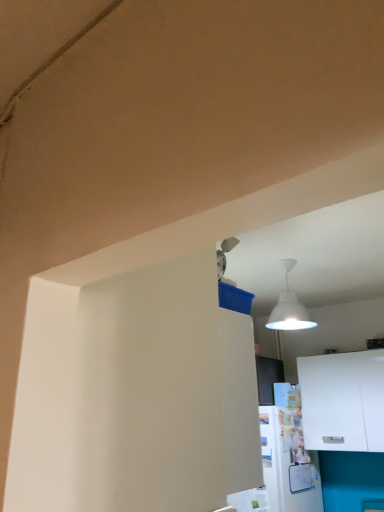
Question: Is point [354, 443] closer or farther from the camera than point [307, 504]?

Choices:
 (A) closer
 (B) farther

Answer: (A)

Question: Looking at the image, does white matte cabinet at lower right seem bigger or smaller compared to white glossy refrigerator at lower right?

Choices:
 (A) small
 (B) big

Answer: (A)

Question: From a real-world perspective, relative to white glossy refrigerator at lower right, is white matte cabinet at lower right vertically above or below?

Choices:
 (A) above
 (B) below

Answer: (A)

Question: Visually, is white glossy refrigerator at lower right positioned to the left or to the right of white matte cabinet at lower right?

Choices:
 (A) right
 (B) left

Answer: (B)

Question: Is white glossy refrigerator at lower right taller or shorter than white matte cabinet at lower right?

Choices:
 (A) short
 (B) tall

Answer: (B)

Question: Is white glossy refrigerator at lower right inside the boundaries of white matte cabinet at lower right, or outside?

Choices:
 (A) inside
 (B) outside

Answer: (B)

Question: Does point (248, 500) appear closer or farther from the camera than point (304, 398)?

Choices:
 (A) farther
 (B) closer

Answer: (B)